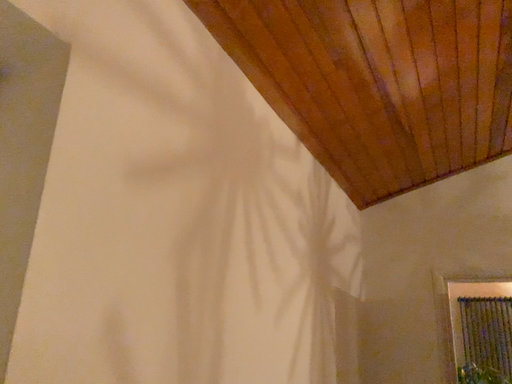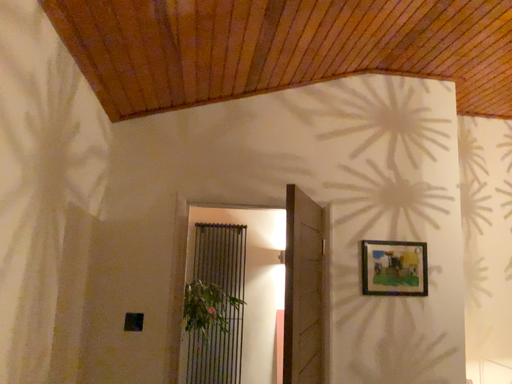
Question: Which way did the camera rotate in the video?

Choices:
 (A) rotated upward
 (B) rotated downward

Answer: (B)